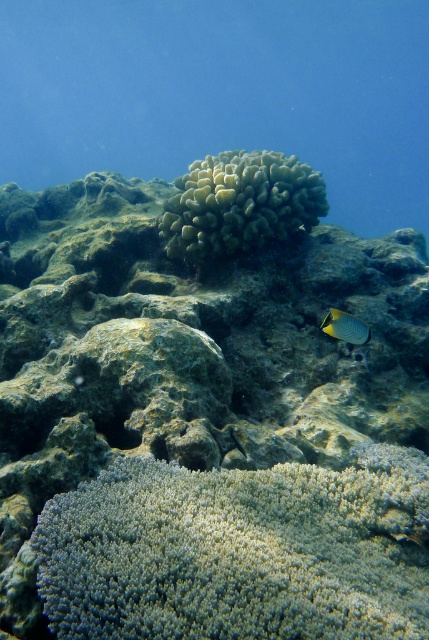
From the picture: You are a marine biologist observing the underwater scene. You notice the white coral at center and the shiny silver fish at center right. Which object occupies more horizontal space in the image?

The white coral at center has a larger width than the shiny silver fish at center right, so it occupies more horizontal space.

You are a marine biologist observing an underwater scene. You notice the white coral at center and the shiny silver fish at center right. Based on their positions, which object is more to the right?

The shiny silver fish at center right is more to the right because it is positioned on the right side of the white coral at center.